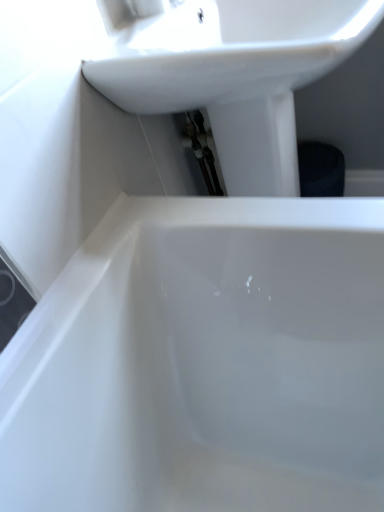
This screenshot has height=512, width=384. In order to click on white glossy sink at upper center in this screenshot , I will do `click(233, 73)`.

Image resolution: width=384 pixels, height=512 pixels. What do you see at coordinates (233, 73) in the screenshot?
I see `white glossy sink at upper center` at bounding box center [233, 73].

Locate an element on the screen. white glossy sink at upper center is located at coordinates (233, 73).